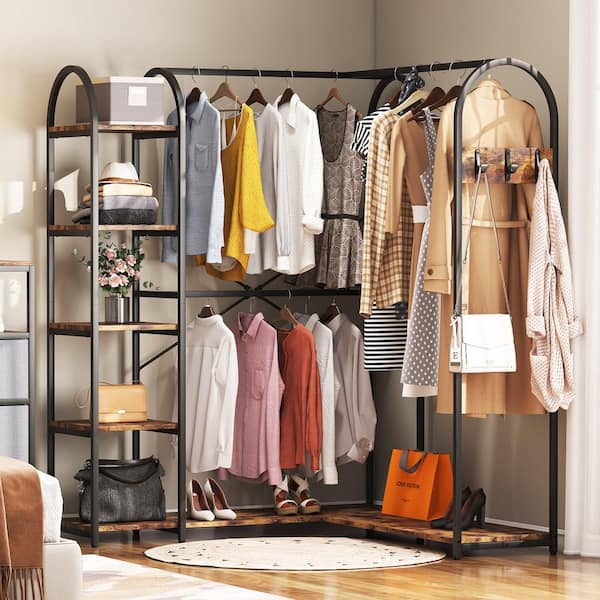
The image size is (600, 600). In order to click on fringe piece at end of blanket in this screenshot , I will do `click(44, 577)`, `click(35, 572)`, `click(32, 586)`, `click(26, 585)`, `click(16, 579)`, `click(9, 590)`, `click(7, 583)`, `click(3, 583)`.